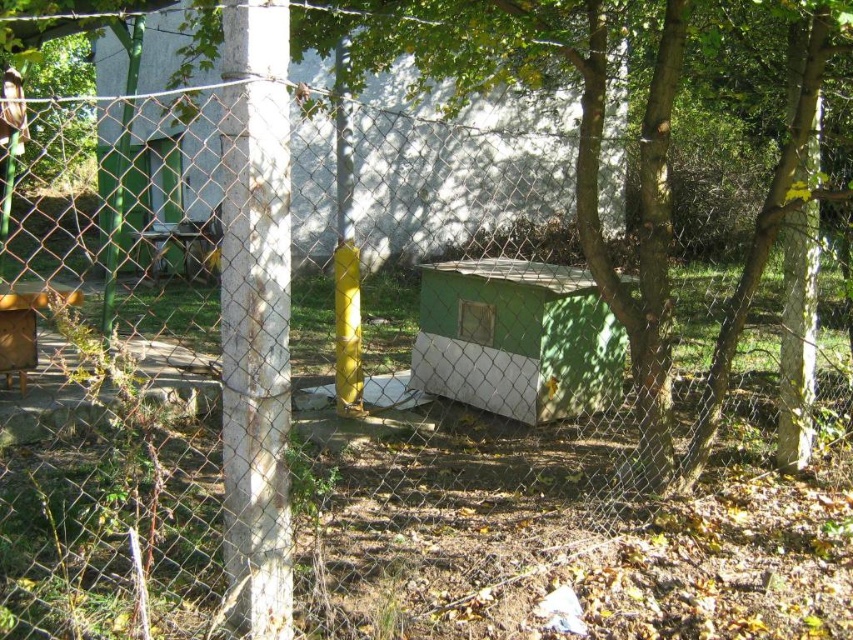
Does white concrete pole at center have a larger size compared to green matte/hardobject at center?

Incorrect, white concrete pole at center is not larger than green matte/hardobject at center.

Does white concrete pole at center appear on the right side of green matte/hardobject at center?

Incorrect, white concrete pole at center is not on the right side of green matte/hardobject at center.

Where is `white concrete pole at center`? This screenshot has width=853, height=640. white concrete pole at center is located at coordinates (254, 316).

Does green matte/hard plastic hut at center come behind green matte/hardobject at center?

Yes, it is.

Where is `green matte/hard plastic hut at center`? green matte/hard plastic hut at center is located at coordinates (456, 164).

This screenshot has width=853, height=640. Describe the element at coordinates (456, 164) in the screenshot. I see `green matte/hard plastic hut at center` at that location.

Is point (178, 4) positioned after point (279, 234)?

Yes, it is.

Identify the location of green matte/hard plastic hut at center. (456, 164).